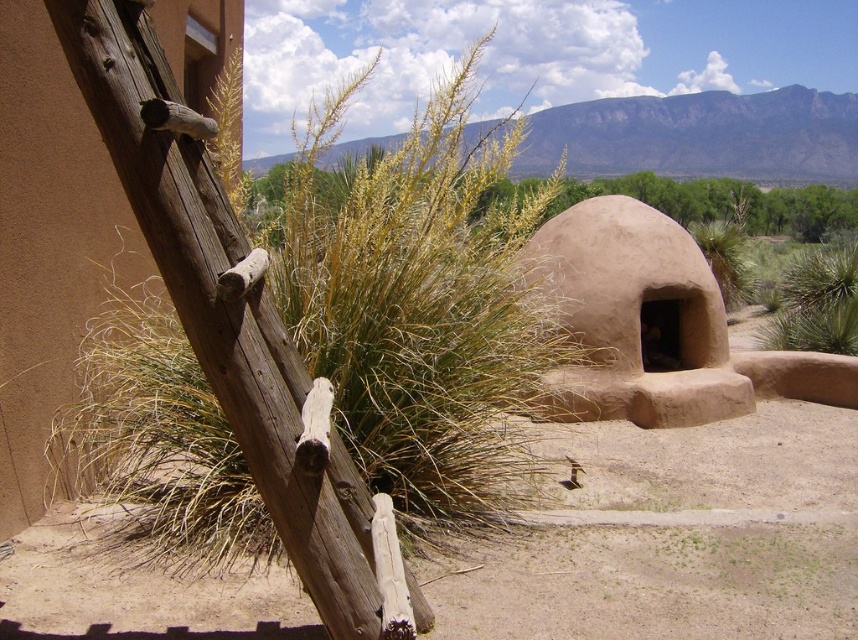
Question: Does dry grass at left appear on the left side of yellow grass at center?

Choices:
 (A) no
 (B) yes

Answer: (B)

Question: Is dry grass at left above yellow grass at center?

Choices:
 (A) no
 (B) yes

Answer: (A)

Question: Which point is closer to the camera?

Choices:
 (A) (651, 198)
 (B) (462, 228)

Answer: (B)

Question: Is dry grass at left positioned behind yellow grass at center?

Choices:
 (A) yes
 (B) no

Answer: (B)